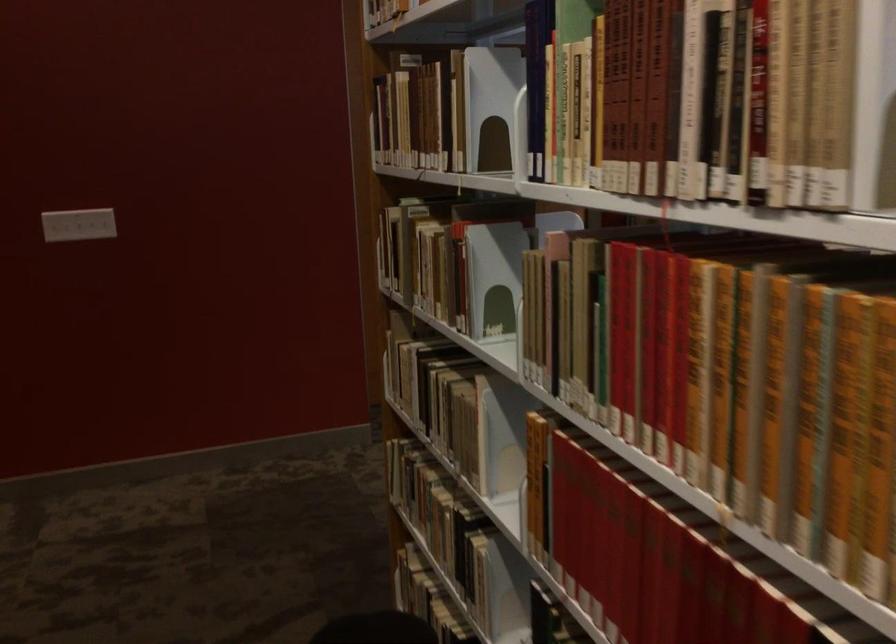
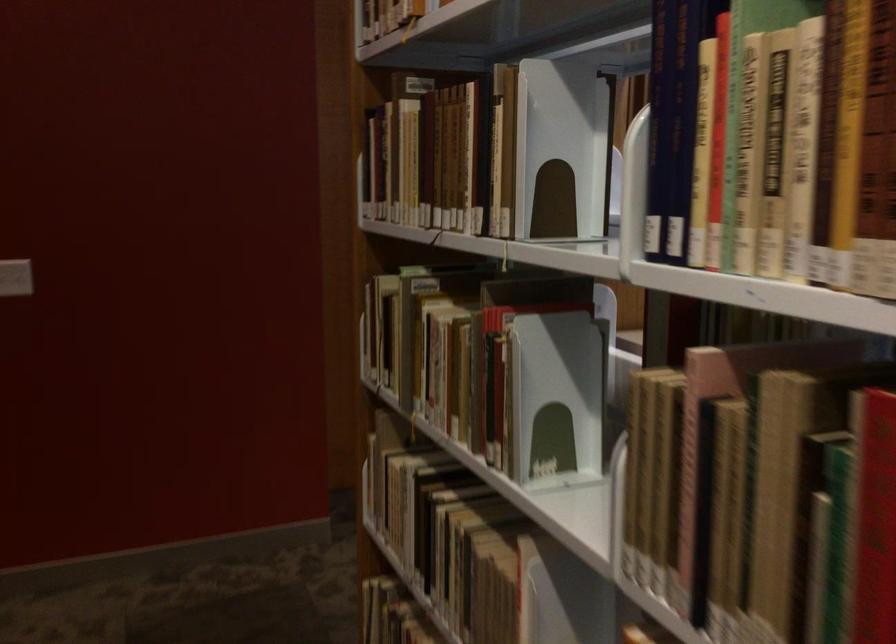
The point at [452,245] is marked in the first image. Where is the corresponding point in the second image?

(484, 342)